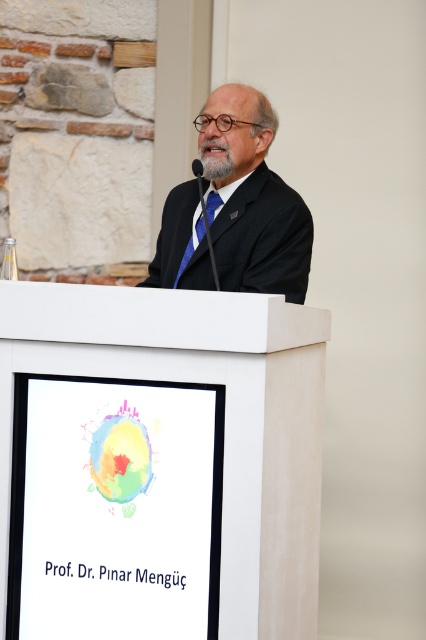
Question: Where is black matte suit at center located in relation to blue silk tie at center in the image?

Choices:
 (A) below
 (B) above

Answer: (B)

Question: Which object is closer to the camera taking this photo?

Choices:
 (A) blue silk tie at center
 (B) black matte suit at center
 (C) white matte podium at center

Answer: (C)

Question: Which is nearer to the black matte suit at center?

Choices:
 (A) white matte podium at center
 (B) blue silk tie at center

Answer: (B)

Question: Is black matte suit at center smaller than blue silk tie at center?

Choices:
 (A) no
 (B) yes

Answer: (A)

Question: Does white matte podium at center lie behind black matte suit at center?

Choices:
 (A) yes
 (B) no

Answer: (B)

Question: Which point is farther from the camera taking this photo?

Choices:
 (A) (201, 236)
 (B) (74, 528)

Answer: (A)